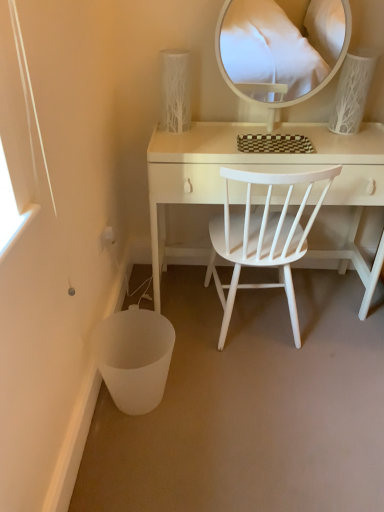
What is the approximate height of white matte trash bin/can at lower left?

white matte trash bin/can at lower left is 10.66 inches in height.

Where is `white matte trash bin/can at lower left`? white matte trash bin/can at lower left is located at coordinates (135, 358).

What do you see at coordinates (262, 170) in the screenshot? The image size is (384, 512). I see `white wood desk at center` at bounding box center [262, 170].

Locate an element on the screen. The width and height of the screenshot is (384, 512). white wood chair at center is located at coordinates (263, 238).

This screenshot has height=512, width=384. What do you see at coordinates (263, 238) in the screenshot? I see `white wood chair at center` at bounding box center [263, 238].

The image size is (384, 512). Describe the element at coordinates (281, 48) in the screenshot. I see `white glossy mirror at upper center` at that location.

Image resolution: width=384 pixels, height=512 pixels. I want to click on white textured vase at upper center, which ranks as the 1th table lamp in left-to-right order, so click(175, 91).

How different are the orientations of white glossy mirror at upper center and white textured vase at upper right, the 1th table lamp when ordered from right to left, in degrees?

The angle between the facing direction of white glossy mirror at upper center and the facing direction of white textured vase at upper right, the 1th table lamp when ordered from right to left, is 1.46 degrees.

Is white glossy mirror at upper center looking in the opposite direction of white textured vase at upper right, the 1th table lamp when ordered from right to left?

No, white glossy mirror at upper center is not facing the opposite direction of white textured vase at upper right, the 1th table lamp when ordered from right to left.

Is white glossy mirror at upper center completely or partially outside of white textured vase at upper right, the 1th table lamp when ordered from right to left?

Absolutely, white glossy mirror at upper center is external to white textured vase at upper right, the 1th table lamp when ordered from right to left.

Between point (300, 52) and point (329, 119), which one is positioned in front?

The point (329, 119) is closer to the camera.

Which is more to the left, white glossy mirror at upper center or white wood desk at center?

From the viewer's perspective, white wood desk at center appears more on the left side.

In the image, is white glossy mirror at upper center positioned in front of or behind white wood desk at center?

white glossy mirror at upper center is positioned closer to the viewer than white wood desk at center.

The height and width of the screenshot is (512, 384). I want to click on desk that appears below the white glossy mirror at upper center (from the image's perspective), so click(x=262, y=170).

From a real-world perspective, is white glossy mirror at upper center positioned above or below white wood desk at center?

In terms of real-world spatial position, white glossy mirror at upper center is above white wood desk at center.

Is white matte trash bin/can at lower left oriented away from white wood chair at center?

white matte trash bin/can at lower left does not have its back to white wood chair at center.

Can you tell me how much white matte trash bin/can at lower left and white wood chair at center differ in facing direction?

There is a 90-degree angle between the facing directions of white matte trash bin/can at lower left and white wood chair at center.

Is white matte trash bin/can at lower left in contact with white wood chair at center?

There is a gap between white matte trash bin/can at lower left and white wood chair at center.

Which of these two, white matte trash bin/can at lower left or white wood chair at center, stands taller?

With more height is white wood chair at center.

Locate an element on the screen. The height and width of the screenshot is (512, 384). mirror lying behind the white wood chair at center is located at coordinates (281, 48).

Is white glossy mirror at upper center turned away from white wood chair at center?

No, white glossy mirror at upper center's orientation is not away from white wood chair at center.

Between white glossy mirror at upper center and white wood chair at center, which one has more height?

Standing taller between the two is white wood chair at center.

Does white glossy mirror at upper center come behind white wood chair at center?

Yes, the depth of white glossy mirror at upper center is greater than that of white wood chair at center.

Which is in front, white textured vase at upper right, the 1th table lamp when ordered from right to left, or white wood chair at center?

white wood chair at center is closer to the camera.

How far apart are white textured vase at upper right, the 1th table lamp when ordered from right to left, and white wood chair at center?

They are 52.03 centimeters apart.

From a real-world perspective, between white textured vase at upper right, the second table lamp positioned from the left, and white wood chair at center, who is vertically higher?

white textured vase at upper right, the second table lamp positioned from the left.

Who is smaller, white textured vase at upper right, the 1th table lamp when ordered from right to left, or white wood chair at center?

With smaller size is white textured vase at upper right, the 1th table lamp when ordered from right to left.

Between white textured vase at upper center, the 2th table lamp viewed from the right, and white textured vase at upper right, the second table lamp positioned from the left, which one has more height?

white textured vase at upper right, the second table lamp positioned from the left, is taller.

Is white textured vase at upper center, which ranks as the 1th table lamp in left-to-right order, oriented away from white textured vase at upper right, the 1th table lamp when ordered from right to left?

No, white textured vase at upper center, which ranks as the 1th table lamp in left-to-right order,'s orientation is not away from white textured vase at upper right, the 1th table lamp when ordered from right to left.

You are a GUI agent. You are given a task and a screenshot of the screen. Output one action in this format:
    pyautogui.click(x=<x>, y=<y>)
    Task: Click on the table lamp on the right of the white textured vase at upper center, the 2th table lamp viewed from the right
    
    Given the screenshot: What is the action you would take?
    point(353,90)

From a real-world perspective, is white textured vase at upper center, which ranks as the 1th table lamp in left-to-right order, below white textured vase at upper right, the second table lamp positioned from the left?

Yes, from a real-world perspective, white textured vase at upper center, which ranks as the 1th table lamp in left-to-right order, is beneath white textured vase at upper right, the second table lamp positioned from the left.

From the picture: Considering the positions of objects white textured vase at upper center, which ranks as the 1th table lamp in left-to-right order, and white wood chair at center in the image provided, who is in front, white textured vase at upper center, which ranks as the 1th table lamp in left-to-right order, or white wood chair at center?

Positioned in front is white wood chair at center.

Can you confirm if white textured vase at upper center, which ranks as the 1th table lamp in left-to-right order, is wider than white wood chair at center?

No.

Locate an element on the screen. The width and height of the screenshot is (384, 512). chair on the right of white textured vase at upper center, which ranks as the 1th table lamp in left-to-right order is located at coordinates (263, 238).

At what (x,y) coordinates should I click in order to perform the action: click on mirror that appears on the left of white textured vase at upper right, the 1th table lamp when ordered from right to left. Please return your answer as a coordinate pair (x, y). The image size is (384, 512). Looking at the image, I should click on (281, 48).

Image resolution: width=384 pixels, height=512 pixels. In the image, there is a white glossy mirror at upper center. What are the coordinates of `desk below it (from a real-world perspective)` in the screenshot? It's located at (262, 170).

Based on their spatial positions, is white matte trash bin/can at lower left or white wood chair at center closer to white textured vase at upper right, the second table lamp positioned from the left?

white wood chair at center is positioned closer to the anchor white textured vase at upper right, the second table lamp positioned from the left.

Which object lies further to the anchor point white wood desk at center, white textured vase at upper right, the second table lamp positioned from the left, or white textured vase at upper center, the 2th table lamp viewed from the right?

The object further to white wood desk at center is white textured vase at upper center, the 2th table lamp viewed from the right.

Considering their positions, is white wood chair at center positioned further to white matte trash bin/can at lower left than white wood desk at center?

Among the two, white wood desk at center is located further to white matte trash bin/can at lower left.

Considering their positions, is white wood desk at center positioned closer to white textured vase at upper center, the 2th table lamp viewed from the right, than white matte trash bin/can at lower left?

The object closer to white textured vase at upper center, the 2th table lamp viewed from the right, is white wood desk at center.

When comparing their distances from white textured vase at upper center, the 2th table lamp viewed from the right, does white matte trash bin/can at lower left or white wood desk at center seem closer?

The object closer to white textured vase at upper center, the 2th table lamp viewed from the right, is white wood desk at center.

When comparing their distances from white textured vase at upper center, the 2th table lamp viewed from the right, does white wood chair at center or white matte trash bin/can at lower left seem closer?

white wood chair at center is closer to white textured vase at upper center, the 2th table lamp viewed from the right.

Estimate the real-world distances between objects in this image. Which object is further from white wood chair at center, white textured vase at upper right, the 1th table lamp when ordered from right to left, or white glossy mirror at upper center?

Based on the image, white glossy mirror at upper center appears to be further to white wood chair at center.

From the image, which object appears to be farther from white matte trash bin/can at lower left, white glossy mirror at upper center or white textured vase at upper center, which ranks as the 1th table lamp in left-to-right order?

white glossy mirror at upper center is positioned further to the anchor white matte trash bin/can at lower left.

Where is `desk that lies between white textured vase at upper right, the 1th table lamp when ordered from right to left, and white wood chair at center from top to bottom`? desk that lies between white textured vase at upper right, the 1th table lamp when ordered from right to left, and white wood chair at center from top to bottom is located at coordinates (262, 170).

This screenshot has height=512, width=384. Identify the location of chair located between white textured vase at upper center, which ranks as the 1th table lamp in left-to-right order, and white textured vase at upper right, the second table lamp positioned from the left, in the left-right direction. (263, 238).

Locate an element on the screen. The height and width of the screenshot is (512, 384). mirror situated between white textured vase at upper center, which ranks as the 1th table lamp in left-to-right order, and white textured vase at upper right, the 1th table lamp when ordered from right to left, from left to right is located at coordinates (281, 48).

Locate an element on the screen. desk between white textured vase at upper center, the 2th table lamp viewed from the right, and white matte trash bin/can at lower left from top to bottom is located at coordinates (262, 170).